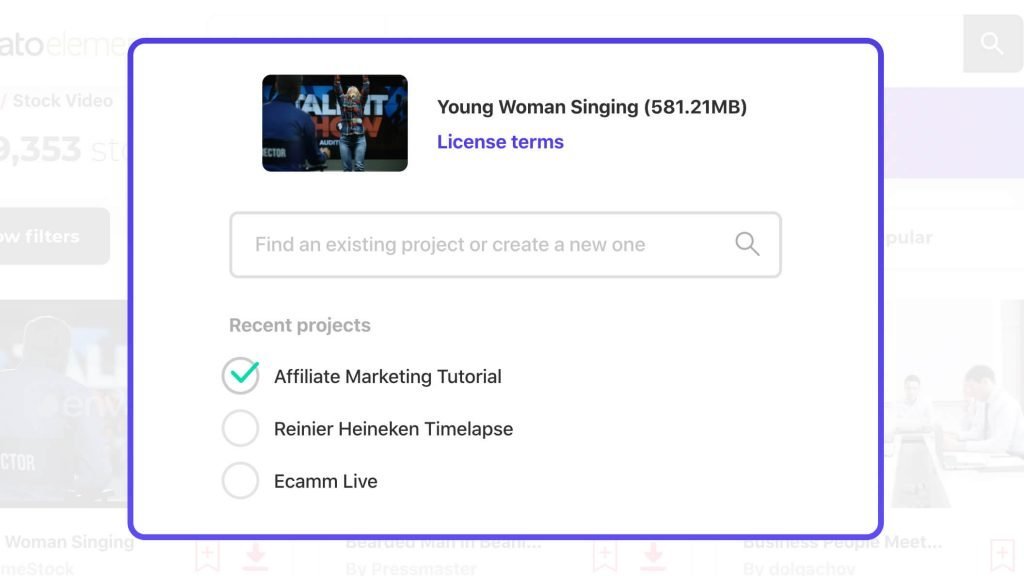
Locate an element on the screen. The width and height of the screenshot is (1024, 576). director chair back of directorback is located at coordinates (274, 153), (284, 112).